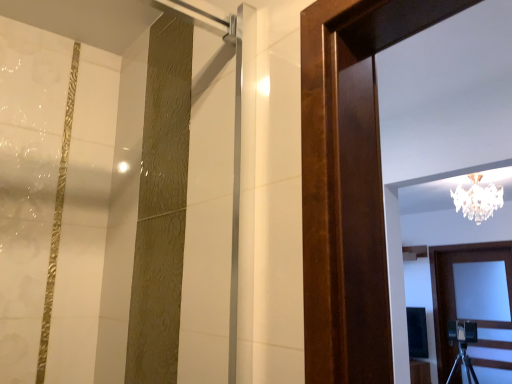
Question: Do you think clear crystal chandelier at upper center is within white wooden door at lower right, or outside of it?

Choices:
 (A) inside
 (B) outside

Answer: (B)

Question: Is point (479, 211) positioned closer to the camera than point (479, 375)?

Choices:
 (A) farther
 (B) closer

Answer: (B)

Question: Considering the positions of clear crystal chandelier at upper center and white wooden door at lower right in the image, is clear crystal chandelier at upper center taller or shorter than white wooden door at lower right?

Choices:
 (A) short
 (B) tall

Answer: (A)

Question: Considering their positions, is white wooden door at lower right located in front of or behind clear crystal chandelier at upper center?

Choices:
 (A) front
 (B) behind

Answer: (B)

Question: From the image's perspective, is white wooden door at lower right above or below clear crystal chandelier at upper center?

Choices:
 (A) below
 (B) above

Answer: (A)

Question: Is point (494, 342) positioned closer to the camera than point (484, 206)?

Choices:
 (A) farther
 (B) closer

Answer: (A)

Question: Is white wooden door at lower right situated inside clear crystal chandelier at upper center or outside?

Choices:
 (A) inside
 (B) outside

Answer: (B)